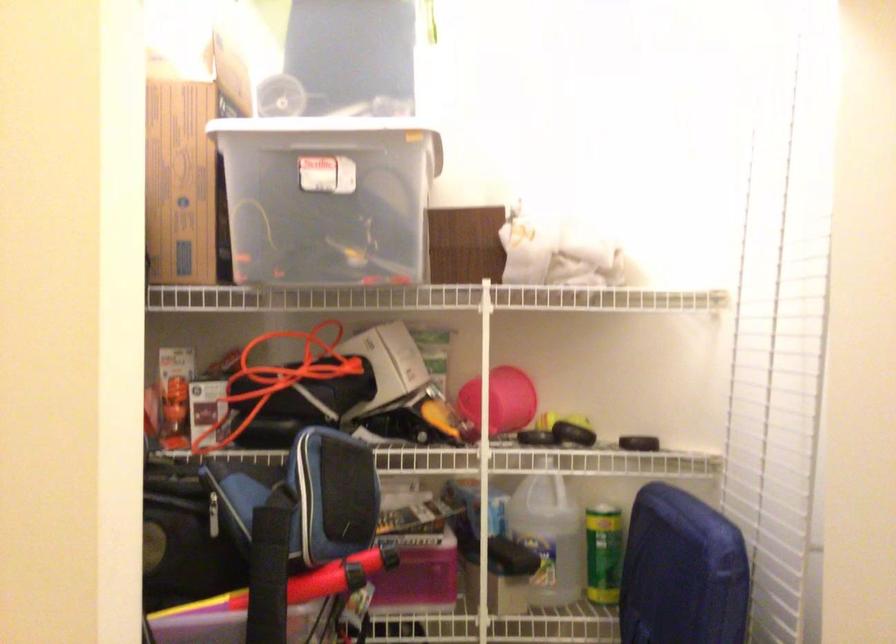
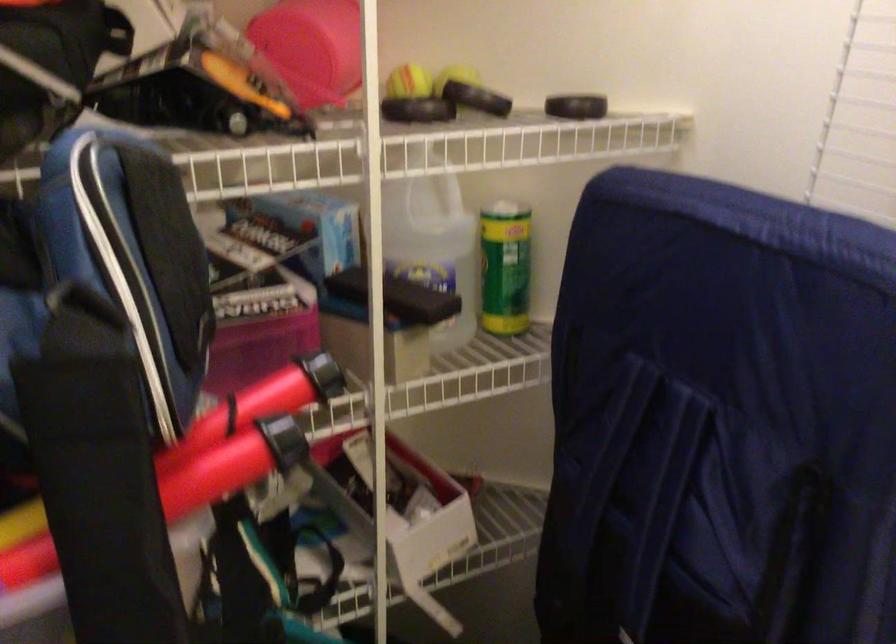
In the second image, find the point that corresponds to point 350,574 in the first image.

(282, 440)